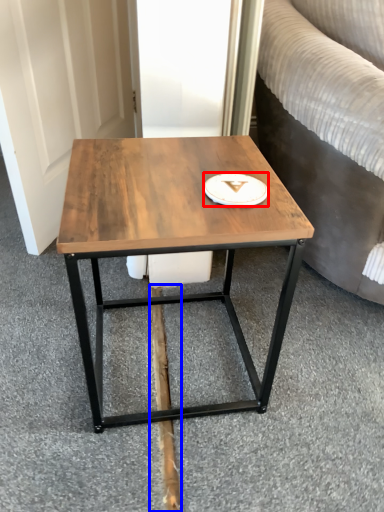
Question: Which object appears farthest to the camera in this image, platter (highlighted by a red box) or plank (highlighted by a blue box)?

Choices:
 (A) platter
 (B) plank

Answer: (B)